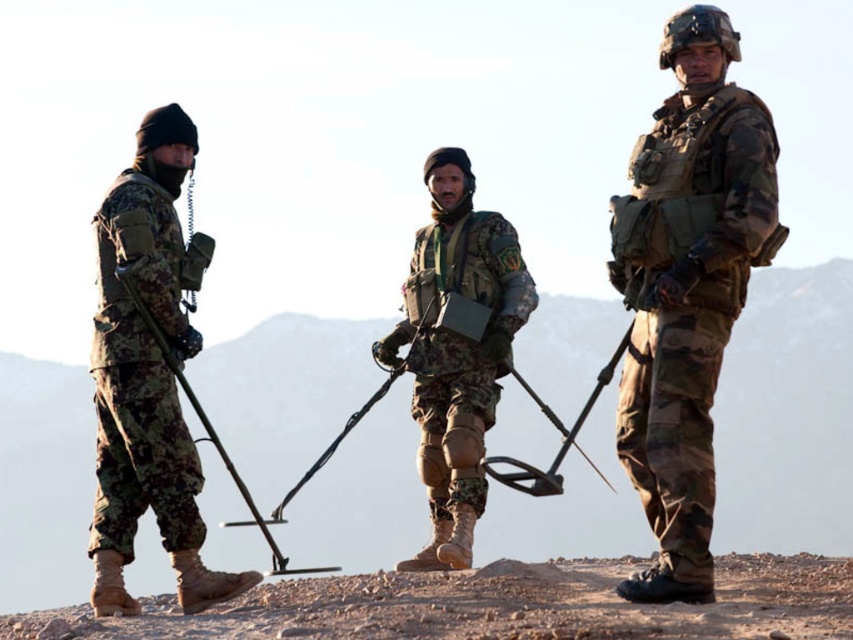
In the scene shown: You are part of a military team in the desert. You need to identify which member is taller based on their equipment. Which one is taller between the camouflage fabric uniform at left and the camouflage fabric vest at center?

The camouflage fabric uniform at left is much taller than the camouflage fabric vest at center.

You are a military observer in the desert. You see two soldiers wearing camo fabric uniform at right and camouflage fabric uniform at left. Which soldier is positioned more to the east?

The camo fabric uniform at right is positioned more to the east because it is to the right of the camouflage fabric uniform at left.

You are a member of the team and need to quickly locate the camo fabric uniform at right and the camouflage fabric vest at center. Based on their positions, which one is positioned more to the east?

The camo fabric uniform at right is positioned more to the east because it is to the right of the camouflage fabric vest at center, and in the image, right corresponds to east.